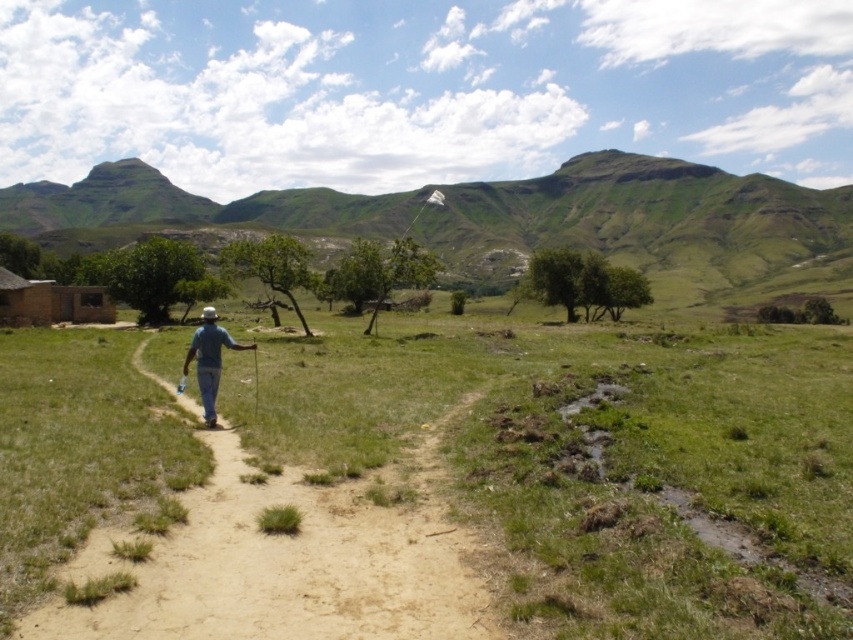
Question: Is green grassy at center thinner than blue denim jeans at center?

Choices:
 (A) yes
 (B) no

Answer: (B)

Question: Is green grassy at center bigger than blue denim jeans at center?

Choices:
 (A) yes
 (B) no

Answer: (A)

Question: Which object is farther from the camera taking this photo?

Choices:
 (A) green grassy mountain at upper center
 (B) blue denim jeans at center

Answer: (A)

Question: Among these points, which one is farthest from the camera?

Choices:
 (A) (851, 205)
 (B) (575, 497)
 (C) (184, 365)

Answer: (A)

Question: Does green grassy mountain at upper center appear on the right side of blue denim jeans at center?

Choices:
 (A) no
 (B) yes

Answer: (A)

Question: Which point is farther to the camera?

Choices:
 (A) (677, 188)
 (B) (233, 348)
 (C) (602, 577)

Answer: (A)